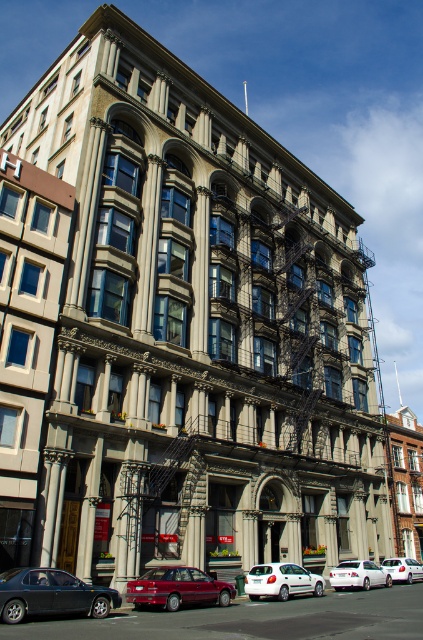
You are standing in front of the building and want to determine the relative positions of two points marked on the facade. Which point is closer to you, point at coordinate point (8,596) or point at coordinate point (415,570)?

Point at coordinate point (8,596) is closer to the viewer than point at coordinate point (415,570).

You are standing in front of the classical building and want to locate two specific points marked on the facade. The first point is at coordinate point [275,592], and the second is at coordinate point [359,570]. Which of these two points is closer to your current position?

Point [275,592] is in front of point [359,570], so the first point is closer to your current position.

You are a delivery person trying to park a truck that is 2 meters wide. You see a matte black sedan at lower left and a silver metallic hatchback at center in the parking lot. Can you park your truck between these two vehicles?

The matte black sedan at lower left is narrower than the silver metallic hatchback at center. However, the exact distance between them isn not specified. Without knowing the space between the two cars, it is impossible to determine if the truck can fit.